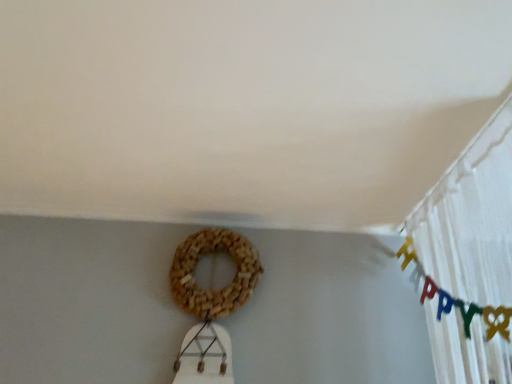
Question: Is white sheer curtain at upper right at the right side of brown woven wreath at center?

Choices:
 (A) no
 (B) yes

Answer: (B)

Question: Does white sheer curtain at upper right touch brown woven wreath at center?

Choices:
 (A) yes
 (B) no

Answer: (B)

Question: Considering the relative sizes of white sheer curtain at upper right and brown woven wreath at center in the image provided, is white sheer curtain at upper right wider than brown woven wreath at center?

Choices:
 (A) no
 (B) yes

Answer: (B)

Question: Is white sheer curtain at upper right turned away from brown woven wreath at center?

Choices:
 (A) no
 (B) yes

Answer: (B)

Question: From the image's perspective, is white sheer curtain at upper right located beneath brown woven wreath at center?

Choices:
 (A) yes
 (B) no

Answer: (B)

Question: Is white sheer curtain at upper right thinner than brown woven wreath at center?

Choices:
 (A) no
 (B) yes

Answer: (A)

Question: Can you confirm if brown woven wreath at center is wider than white sheer curtain at upper right?

Choices:
 (A) no
 (B) yes

Answer: (A)

Question: Is brown woven wreath at center positioned beyond the bounds of white sheer curtain at upper right?

Choices:
 (A) yes
 (B) no

Answer: (A)

Question: Considering the relative sizes of brown woven wreath at center and white sheer curtain at upper right in the image provided, is brown woven wreath at center smaller than white sheer curtain at upper right?

Choices:
 (A) no
 (B) yes

Answer: (B)

Question: Is brown woven wreath at center far away from white sheer curtain at upper right?

Choices:
 (A) no
 (B) yes

Answer: (A)

Question: Is brown woven wreath at center looking in the opposite direction of white sheer curtain at upper right?

Choices:
 (A) yes
 (B) no

Answer: (B)

Question: From the image's perspective, is brown woven wreath at center over white sheer curtain at upper right?

Choices:
 (A) yes
 (B) no

Answer: (B)

Question: In terms of width, does brown woven wreath at center look wider or thinner when compared to white sheer curtain at upper right?

Choices:
 (A) wide
 (B) thin

Answer: (B)